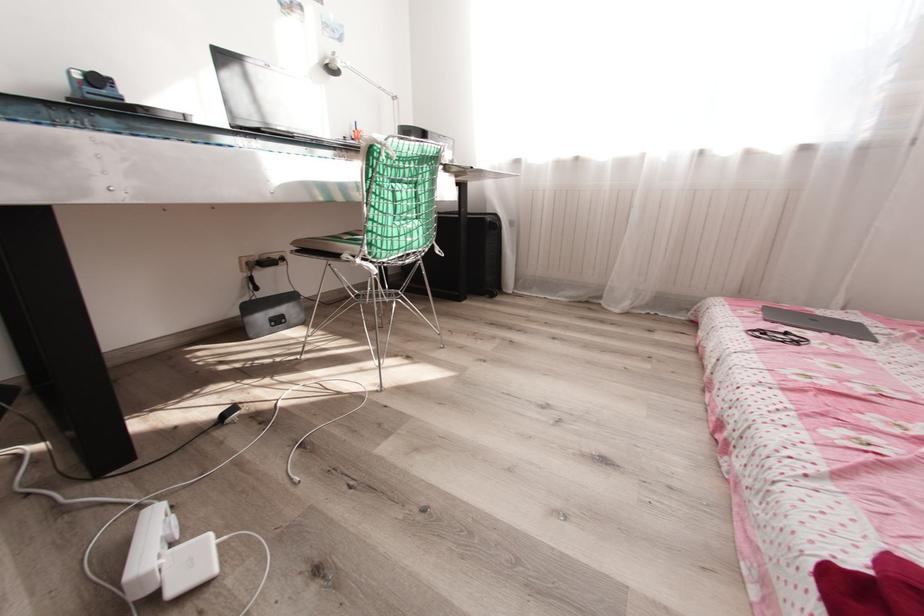
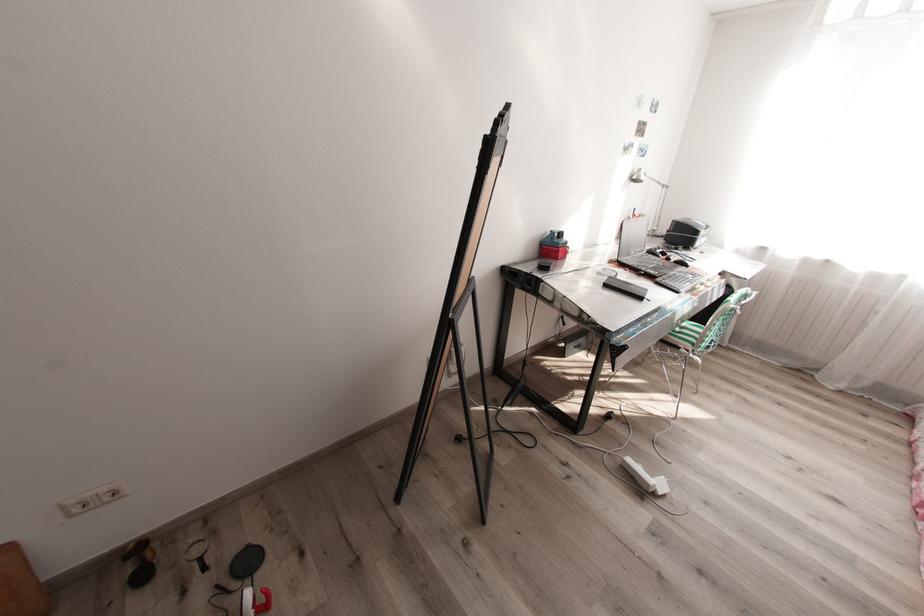
Which direction would the cameraman need to move to produce the second image?

Answer: The cameraman moved toward left, backward.